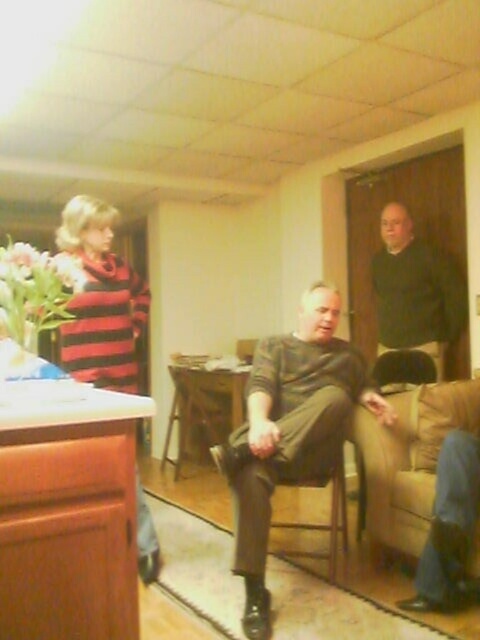
The height and width of the screenshot is (640, 480). I want to click on beige fabric couch at lower right, so click(x=408, y=460).

Does point (394, 524) come closer to viewer compared to point (133, 348)?

No.

Find the location of `beige fabric couch at lower right`. beige fabric couch at lower right is located at coordinates (408, 460).

Does striped sweater at left appear on the right side of dark green sweater at upper right?

No, striped sweater at left is not to the right of dark green sweater at upper right.

Does striped sweater at left come in front of dark green sweater at upper right?

Yes, striped sweater at left is in front of dark green sweater at upper right.

This screenshot has width=480, height=640. In order to click on striped sweater at left in this screenshot , I will do `click(100, 300)`.

The width and height of the screenshot is (480, 640). I want to click on striped sweater at left, so click(x=100, y=300).

Does striped sweater at left have a larger size compared to wooden at center?

Actually, striped sweater at left might be smaller than wooden at center.

Can you confirm if striped sweater at left is taller than wooden at center?

Yes.

Is point (97, 324) farther from camera compared to point (304, 483)?

That is False.

Where is `striped sweater at left`? This screenshot has width=480, height=640. striped sweater at left is located at coordinates pyautogui.click(x=100, y=300).